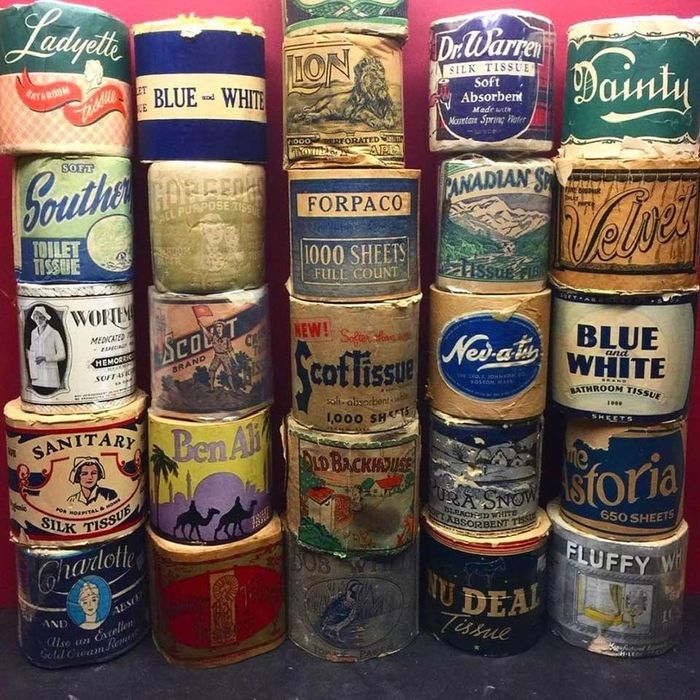
The height and width of the screenshot is (700, 700). I want to click on counter, so pos(140,645).